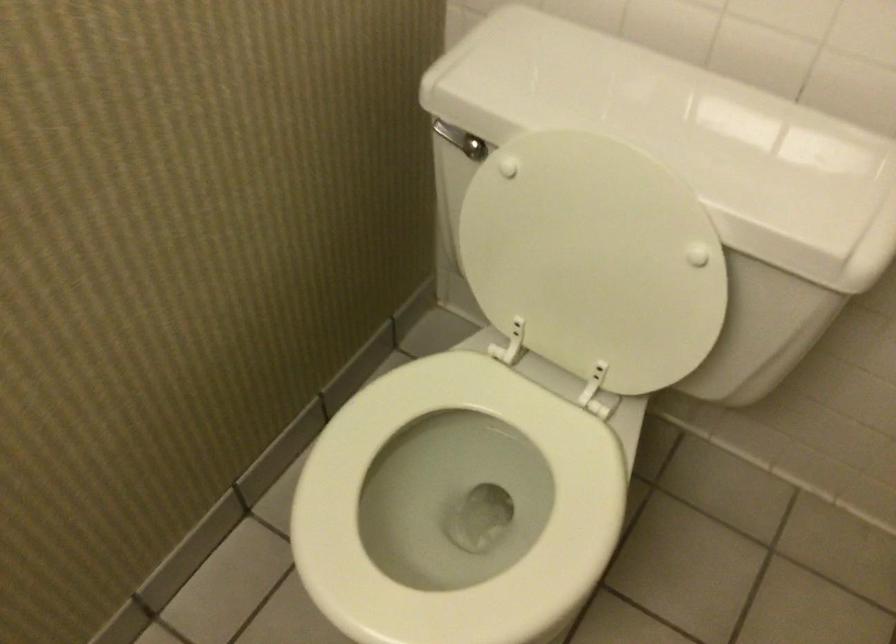
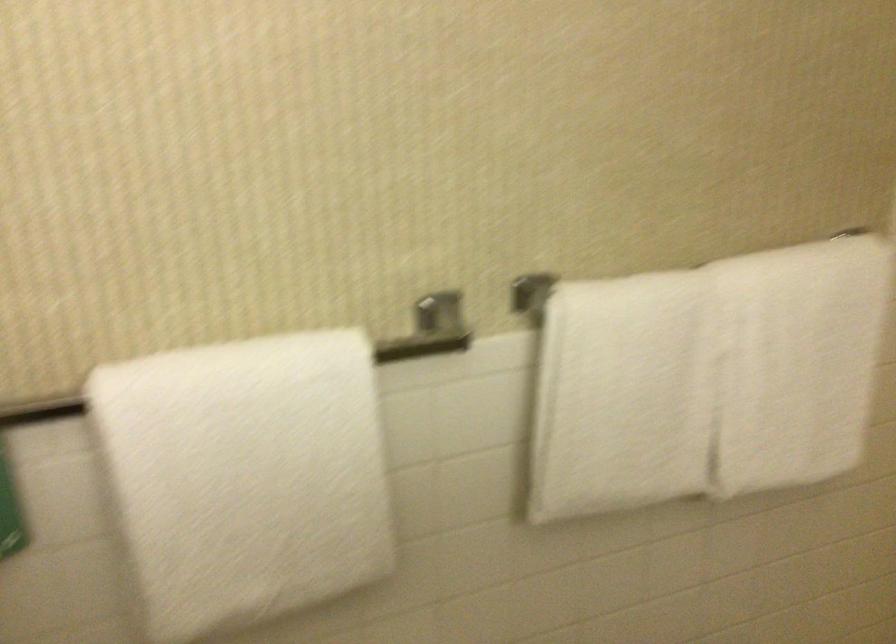
Question: The camera is either moving clockwise (left) or counter-clockwise (right) around the object. The first image is from the beginning of the video and the second image is from the end. Is the camera moving left or right when shooting the video?

Choices:
 (A) Left
 (B) Right

Answer: (A)